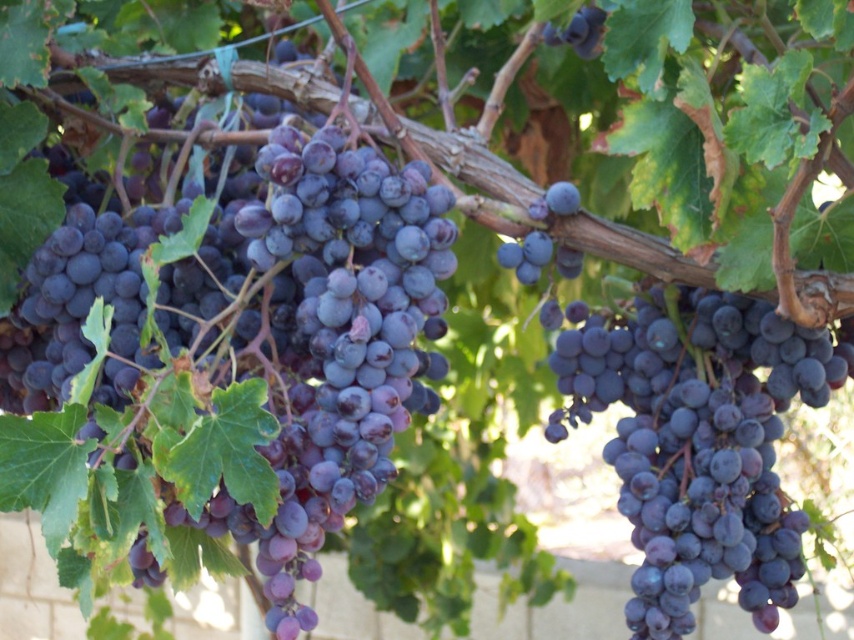
What do you see at coordinates (699, 442) in the screenshot? The image size is (854, 640). I see `shiny dark purple grapes at center` at bounding box center [699, 442].

Image resolution: width=854 pixels, height=640 pixels. I want to click on shiny dark purple grapes at center, so click(699, 442).

Is point (383, 216) farther from camera compared to point (733, 392)?

No.

Is purple matte grapes at center shorter than shiny dark purple grapes at center?

No, purple matte grapes at center is not shorter than shiny dark purple grapes at center.

Between point (401, 180) and point (656, 300), which one is positioned behind?

Positioned behind is point (656, 300).

Find the location of a particular element. The width and height of the screenshot is (854, 640). purple matte grapes at center is located at coordinates (227, 365).

Which is below, purple matte grapes at center or dark purple grape at upper right?

purple matte grapes at center

Who is positioned more to the left, purple matte grapes at center or dark purple grape at upper right?

purple matte grapes at center is more to the left.

Which is behind, point (180, 452) or point (571, 36)?

The point (571, 36) is behind.

I want to click on purple matte grapes at center, so click(x=227, y=365).